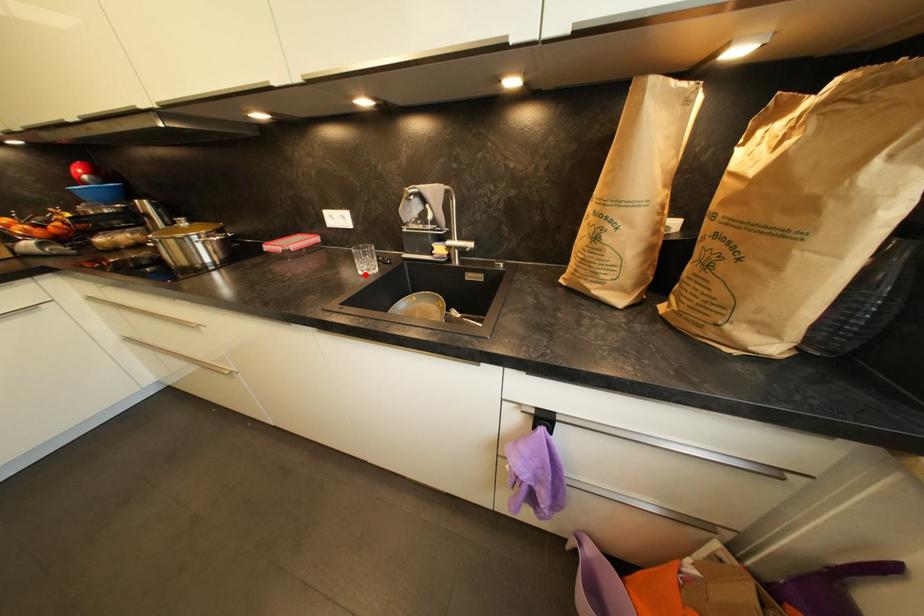
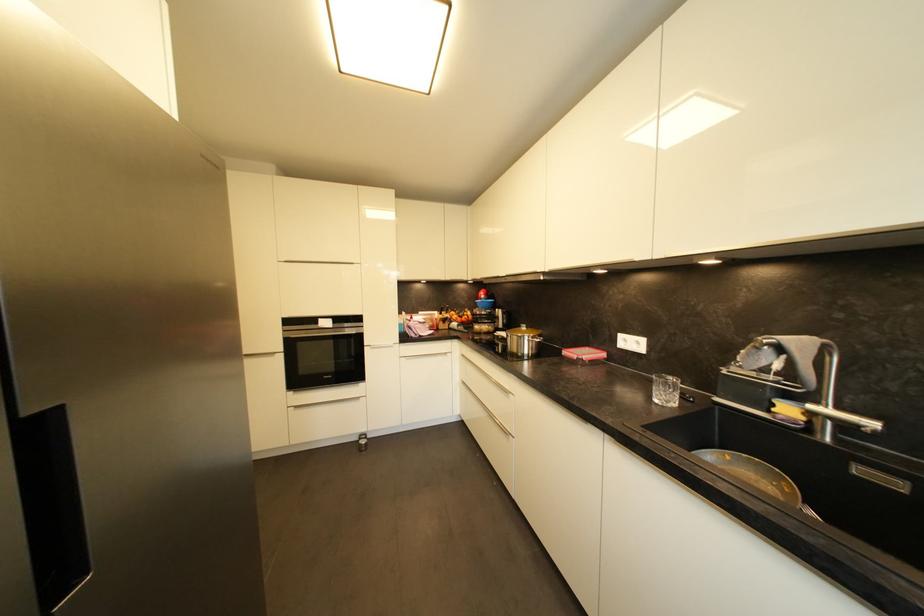
Find the pixel in the second image that matches the highlighted location in the first image.

(661, 403)